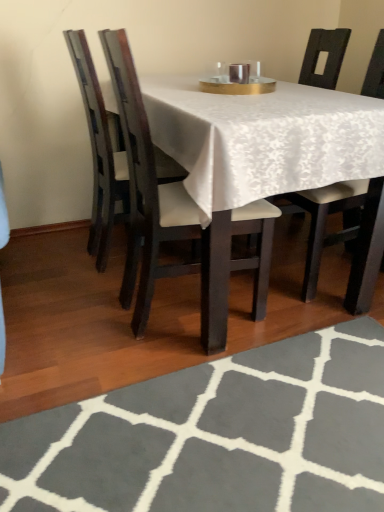
Measure the distance between point [309,39] and camera.

7.33 feet.

Locate an element on the screen. matte black chair at left, positioned as the third chair in right-to-left order is located at coordinates (99, 154).

Identify the location of white fabric chair at center, the third chair positioned from the left. This screenshot has width=384, height=512. (326, 221).

How different are the orientations of gray woolen rug at lower center and white fabric chair at center, which is counted as the first chair, starting from the right, in degrees?

The angular difference between gray woolen rug at lower center and white fabric chair at center, which is counted as the first chair, starting from the right, is 0.495 degrees.

Does point (351, 376) appear closer or farther from the camera than point (327, 207)?

Point (351, 376) is closer to the camera than point (327, 207).

Is gray woolen rug at lower center smaller than white fabric chair at center, which is counted as the first chair, starting from the right?

Yes.

Considering the points (172, 468) and (128, 87), which point is behind, point (172, 468) or point (128, 87)?

Positioned behind is point (128, 87).

Is there a large distance between gray woolen rug at lower center and dark wood chair at center, the second chair positioned from the left?

No, gray woolen rug at lower center is not far from dark wood chair at center, the second chair positioned from the left.

Is gray woolen rug at lower center surrounding dark wood chair at center, which is the 2th chair in right-to-left order?

Actually, dark wood chair at center, which is the 2th chair in right-to-left order, is outside gray woolen rug at lower center.

Starting from the matte black chair at left, positioned as the third chair in right-to-left order, which chair is the 2nd one to the right? Please provide its 2D coordinates.

[(326, 221)]

From a real-world perspective, does white fabric chair at center, which is counted as the first chair, starting from the right, sit lower than matte black chair at left, positioned as the third chair in right-to-left order?

Actually, white fabric chair at center, which is counted as the first chair, starting from the right, is physically above matte black chair at left, positioned as the third chair in right-to-left order, in the real world.

Considering their positions, is white fabric chair at center, the third chair positioned from the left, located in front of or behind matte black chair at left, positioned as the third chair in right-to-left order?

white fabric chair at center, the third chair positioned from the left, is positioned closer to the viewer than matte black chair at left, positioned as the third chair in right-to-left order.

Is point (113, 170) positioned behind point (322, 40)?

That is False.

Is matte black chair at left, positioned as the third chair in right-to-left order, next to white fabric chair at center, the third chair positioned from the left?

matte black chair at left, positioned as the third chair in right-to-left order, and white fabric chair at center, the third chair positioned from the left, are not in contact.

From the image's perspective, relative to white fabric chair at center, the third chair positioned from the left, is matte black chair at left, positioned as the third chair in right-to-left order, above or below?

From the image's perspective, matte black chair at left, positioned as the third chair in right-to-left order, appears above white fabric chair at center, the third chair positioned from the left.

From a real-world perspective, which chair is the 2nd one above the matte black chair at left, positioned as the third chair in right-to-left order? Please provide its 2D coordinates.

[(326, 221)]

Does matte black chair at left, positioned as the third chair in right-to-left order, lie behind gray woolen rug at lower center?

Yes, matte black chair at left, positioned as the third chair in right-to-left order, is behind gray woolen rug at lower center.

Does point (99, 162) appear closer or farther from the camera than point (180, 370)?

Clearly, point (99, 162) is more distant from the camera than point (180, 370).

Which of these two, matte black chair at left, positioned as the third chair in right-to-left order, or gray woolen rug at lower center, stands taller?

With more height is matte black chair at left, positioned as the third chair in right-to-left order.

Does point (136, 316) come behind point (207, 378)?

Yes, it is behind point (207, 378).

Between dark wood chair at center, which is the 2th chair in right-to-left order, and gray woolen rug at lower center, which one has smaller size?

gray woolen rug at lower center is smaller.

Is gray woolen rug at lower center at the back of dark wood chair at center, which is the 2th chair in right-to-left order?

No, dark wood chair at center, which is the 2th chair in right-to-left order,'s orientation is not away from gray woolen rug at lower center.

Is dark wood chair at center, the second chair positioned from the left, positioned in front of gray woolen rug at lower center?

That is False.

Is dark wood chair at center, the second chair positioned from the left, to the left of white fabric chair at center, which is counted as the first chair, starting from the right, from the viewer's perspective?

Correct, you'll find dark wood chair at center, the second chair positioned from the left, to the left of white fabric chair at center, which is counted as the first chair, starting from the right.

Is dark wood chair at center, which is the 2th chair in right-to-left order, outside of white fabric chair at center, the third chair positioned from the left?

Yes, dark wood chair at center, which is the 2th chair in right-to-left order, is outside of white fabric chair at center, the third chair positioned from the left.

Measure the distance between dark wood chair at center, the second chair positioned from the left, and white fabric chair at center, the third chair positioned from the left.

dark wood chair at center, the second chair positioned from the left, is 49.73 centimeters from white fabric chair at center, the third chair positioned from the left.

Locate an element on the screen. The image size is (384, 512). chair that is the 1st one when counting backward from the dark wood chair at center, which is the 2th chair in right-to-left order is located at coordinates (326, 221).

There is a gray woolen rug at lower center. Identify the location of the 3rd chair above it (from a real-world perspective). The width and height of the screenshot is (384, 512). (326, 221).

This screenshot has height=512, width=384. Identify the location of place mat below the dark wood chair at center, the second chair positioned from the left (from the image's perspective). (217, 435).

From the image, which object appears to be nearer to white fabric chair at center, which is counted as the first chair, starting from the right, dark wood chair at center, which is the 2th chair in right-to-left order, or gray woolen rug at lower center?

Based on the image, dark wood chair at center, which is the 2th chair in right-to-left order, appears to be nearer to white fabric chair at center, which is counted as the first chair, starting from the right.

From the image, which object appears to be nearer to dark wood chair at center, the second chair positioned from the left, gray woolen rug at lower center or matte black chair at left, arranged as the first chair when viewed from the left?

matte black chair at left, arranged as the first chair when viewed from the left, is positioned closer to the anchor dark wood chair at center, the second chair positioned from the left.

Which object lies further to the anchor point dark wood chair at center, the second chair positioned from the left, white fabric chair at center, which is counted as the first chair, starting from the right, or matte black chair at left, arranged as the first chair when viewed from the left?

white fabric chair at center, which is counted as the first chair, starting from the right, lies further to dark wood chair at center, the second chair positioned from the left, than the other object.

From the picture: Based on their spatial positions, is matte black chair at left, positioned as the third chair in right-to-left order, or gray woolen rug at lower center closer to dark wood chair at center, the second chair positioned from the left?

The object closer to dark wood chair at center, the second chair positioned from the left, is matte black chair at left, positioned as the third chair in right-to-left order.

When comparing their distances from gray woolen rug at lower center, does dark wood chair at center, which is the 2th chair in right-to-left order, or white fabric chair at center, the third chair positioned from the left, seem closer?

The object closer to gray woolen rug at lower center is dark wood chair at center, which is the 2th chair in right-to-left order.

Based on their spatial positions, is dark wood chair at center, the second chair positioned from the left, or matte black chair at left, arranged as the first chair when viewed from the left, closer to gray woolen rug at lower center?

dark wood chair at center, the second chair positioned from the left, is closer to gray woolen rug at lower center.

Based on their spatial positions, is dark wood chair at center, which is the 2th chair in right-to-left order, or matte black chair at left, positioned as the third chair in right-to-left order, closer to white fabric chair at center, which is counted as the first chair, starting from the right?

dark wood chair at center, which is the 2th chair in right-to-left order, lies closer to white fabric chair at center, which is counted as the first chair, starting from the right, than the other object.

Based on their spatial positions, is white fabric chair at center, which is counted as the first chair, starting from the right, or gray woolen rug at lower center closer to dark wood chair at center, which is the 2th chair in right-to-left order?

gray woolen rug at lower center lies closer to dark wood chair at center, which is the 2th chair in right-to-left order, than the other object.

Where is `chair situated between matte black chair at left, positioned as the third chair in right-to-left order, and white fabric chair at center, which is counted as the first chair, starting from the right, from left to right`? This screenshot has height=512, width=384. chair situated between matte black chair at left, positioned as the third chair in right-to-left order, and white fabric chair at center, which is counted as the first chair, starting from the right, from left to right is located at coordinates (149, 193).

The image size is (384, 512). Find the location of `chair between white fabric chair at center, the third chair positioned from the left, and gray woolen rug at lower center vertically`. chair between white fabric chair at center, the third chair positioned from the left, and gray woolen rug at lower center vertically is located at coordinates (149, 193).